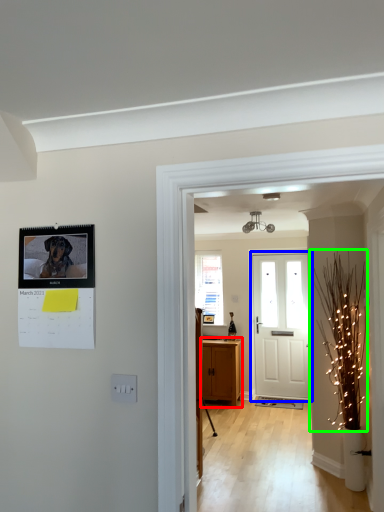
Question: Based on their relative distances, which object is nearer to cabinetry (highlighted by a red box)? Choose from door (highlighted by a blue box) and christmas light (highlighted by a green box).

Choices:
 (A) door
 (B) christmas light

Answer: (A)